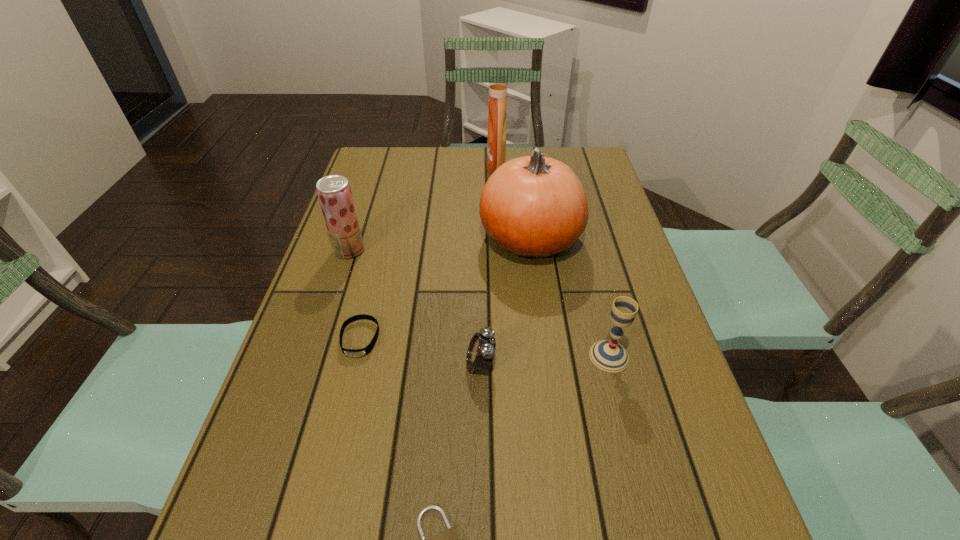
What are the coordinates of `blank space located on the front-facing side of the detergent` in the screenshot? It's located at (383, 168).

At what (x,y) coordinates should I click in order to perform the action: click on vacant area situated on the back of the pumpkin. Please return your answer as a coordinate pair (x, y). Looking at the image, I should click on (522, 177).

The image size is (960, 540). Find the location of `vacant space positioned on the front of the fifth shortest object`. vacant space positioned on the front of the fifth shortest object is located at coordinates (x=321, y=339).

The image size is (960, 540). I want to click on vacant space situated on the front of the chalice, so click(641, 481).

This screenshot has width=960, height=540. What are the coordinates of `free space located on the face of the alarm clock` in the screenshot? It's located at (358, 363).

At what (x,y) coordinates should I click in order to perform the action: click on vacant region located on the face of the alarm clock. Please return your answer as a coordinate pair (x, y). Looking at the image, I should click on (343, 363).

At what (x,y) coordinates should I click in order to perform the action: click on free space located 0.110m on the face of the alarm clock. Please return your answer as a coordinate pair (x, y). This screenshot has height=540, width=960. Looking at the image, I should click on (412, 363).

The width and height of the screenshot is (960, 540). What are the coordinates of `vacant space located 0.170m on the display of the second shortest object` in the screenshot? It's located at (335, 438).

This screenshot has height=540, width=960. What are the coordinates of `object present at the far edge` in the screenshot? It's located at (498, 85).

The height and width of the screenshot is (540, 960). Identify the location of fruit juice that is at the left edge. (334, 193).